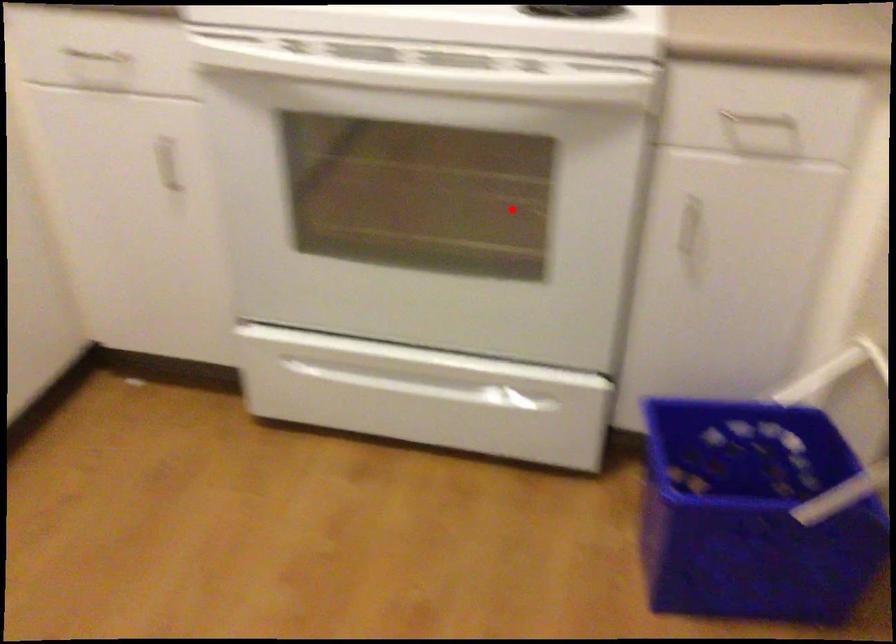
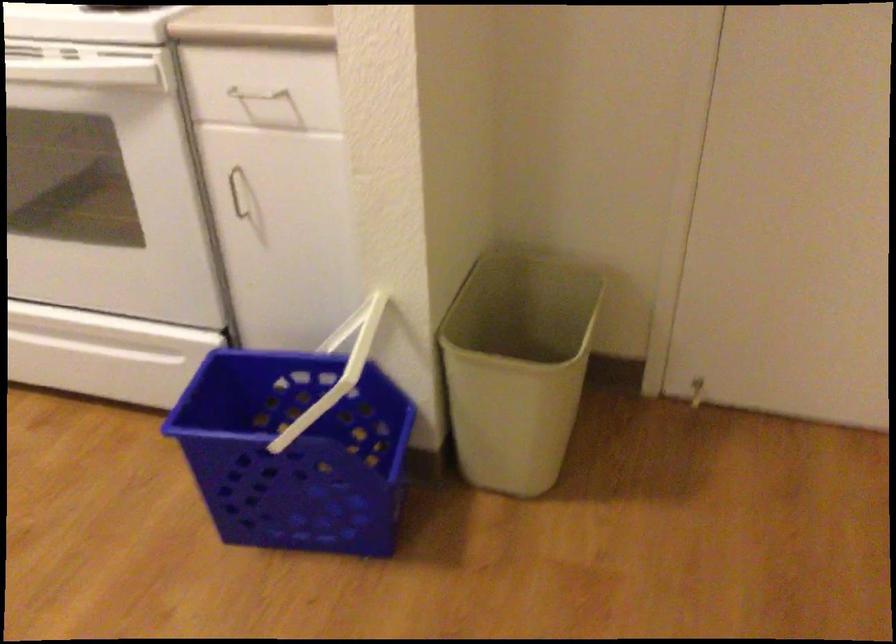
Where in the second image is the point corresponding to the highlighted location from the first image?

(104, 185)